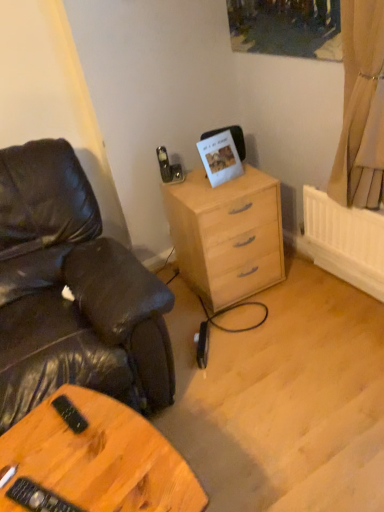
Question: Based on their positions, is black leather chair at left located to the left or right of wooden table at lower left?

Choices:
 (A) left
 (B) right

Answer: (A)

Question: Looking at the image, does black leather chair at left seem bigger or smaller compared to wooden table at lower left?

Choices:
 (A) small
 (B) big

Answer: (B)

Question: Which object is positioned closest to the light wood/finish chest of drawers at center?

Choices:
 (A) beige fabric curtain at upper right
 (B) black leather chair at left
 (C) wooden table at lower left

Answer: (A)

Question: Which of these objects is positioned farthest from the black leather chair at left?

Choices:
 (A) light wood/finish chest of drawers at center
 (B) beige fabric curtain at upper right
 (C) wooden table at lower left

Answer: (B)